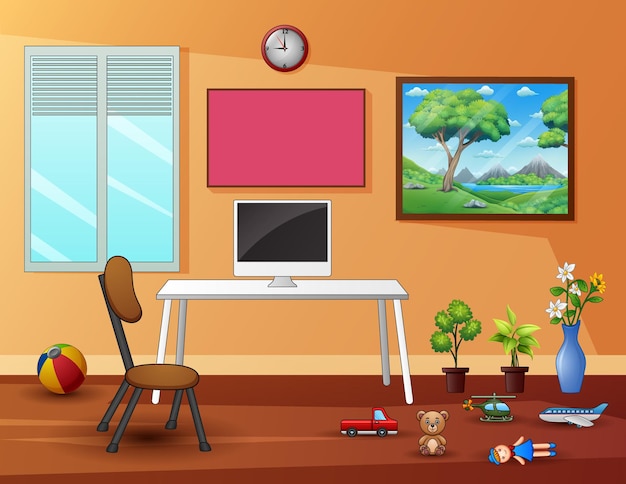
Locate an element on the screen. doll in blue dress is located at coordinates (509, 462).